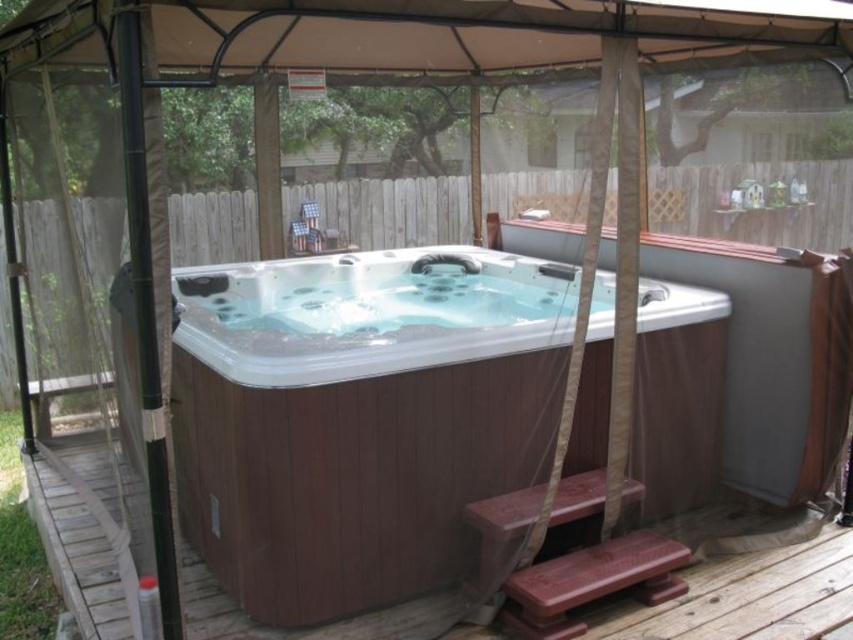
Based on the photo, between brown wood/paneling hot tub at center and brown wood deck at lower center, which one appears on the left side from the viewer's perspective?

brown wood deck at lower center

Can you confirm if brown wood/paneling hot tub at center is wider than brown wood deck at lower center?

Correct, the width of brown wood/paneling hot tub at center exceeds that of brown wood deck at lower center.

This screenshot has height=640, width=853. I want to click on brown wood/paneling hot tub at center, so click(358, 417).